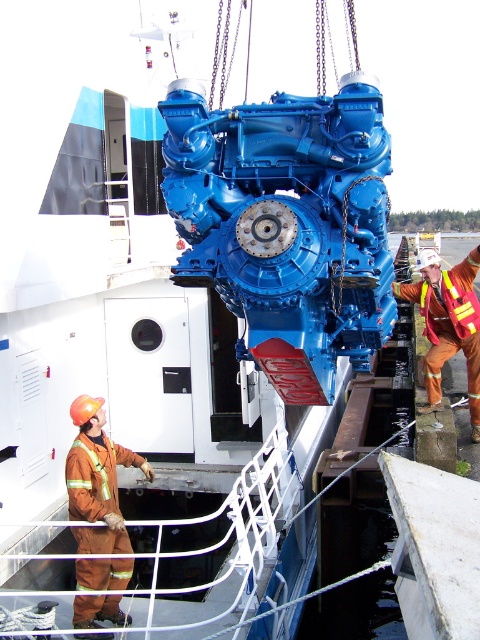
Question: Does brown reflective coveralls at lower left appear on the right side of reflective orange safety vest at right?

Choices:
 (A) yes
 (B) no

Answer: (B)

Question: Can you confirm if orange reflective safety vest at center is positioned to the left of reflective orange safety vest at right?

Choices:
 (A) no
 (B) yes

Answer: (A)

Question: Which object is positioned farthest from the orange reflective safety vest at center?

Choices:
 (A) reflective orange safety vest at right
 (B) brown reflective coveralls at lower left

Answer: (B)

Question: Which point is farther from the camera taking this photo?

Choices:
 (A) (479, 307)
 (B) (84, 612)

Answer: (A)

Question: Does orange reflective safety vest at center appear under reflective orange safety vest at right?

Choices:
 (A) no
 (B) yes

Answer: (A)

Question: Which of the following is the closest to the observer?

Choices:
 (A) (420, 291)
 (B) (432, 330)

Answer: (A)